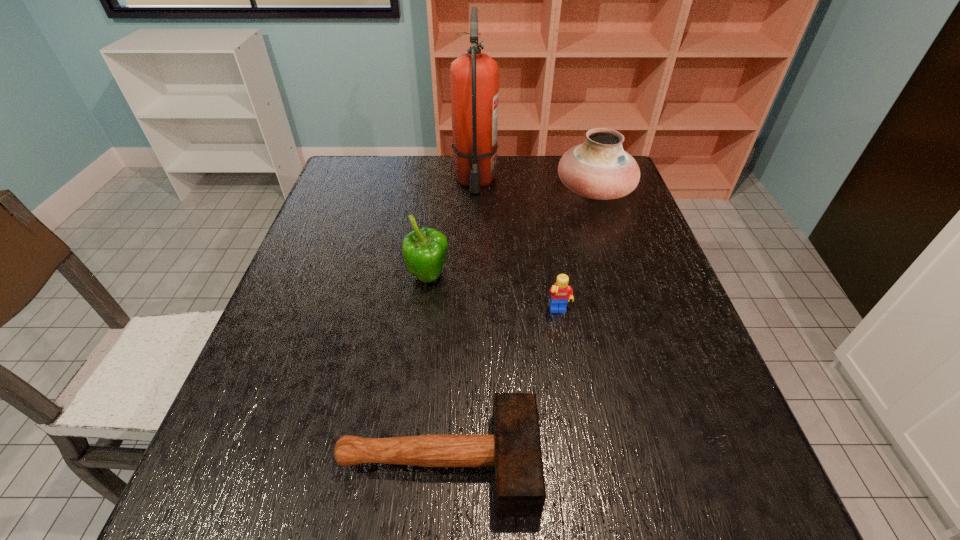
The width and height of the screenshot is (960, 540). I want to click on vacant region between the rightmost object and the tallest object, so click(x=535, y=186).

Image resolution: width=960 pixels, height=540 pixels. In order to click on vacant region between the third nearest object and the fire extinguisher in this screenshot , I will do `click(451, 229)`.

Image resolution: width=960 pixels, height=540 pixels. I want to click on blank region between the rightmost object and the bell pepper, so click(x=511, y=234).

This screenshot has width=960, height=540. Find the location of `vacant point located between the shortest object and the tallest object`. vacant point located between the shortest object and the tallest object is located at coordinates (457, 320).

The width and height of the screenshot is (960, 540). I want to click on blank region between the Lego and the tallest object, so click(x=516, y=246).

The height and width of the screenshot is (540, 960). What are the coordinates of `vacant area that lies between the fire extinguisher and the pottery` in the screenshot? It's located at (535, 186).

I want to click on vacant point located between the tallest object and the rightmost object, so click(535, 186).

Image resolution: width=960 pixels, height=540 pixels. In order to click on free area in between the third nearest object and the nearest object in this screenshot , I will do `click(433, 369)`.

What are the coordinates of `vacant area that lies between the fire extinguisher and the rightmost object` in the screenshot? It's located at (535, 186).

Where is `vacant area between the rightmost object and the fire extinguisher`? The height and width of the screenshot is (540, 960). vacant area between the rightmost object and the fire extinguisher is located at coordinates (535, 186).